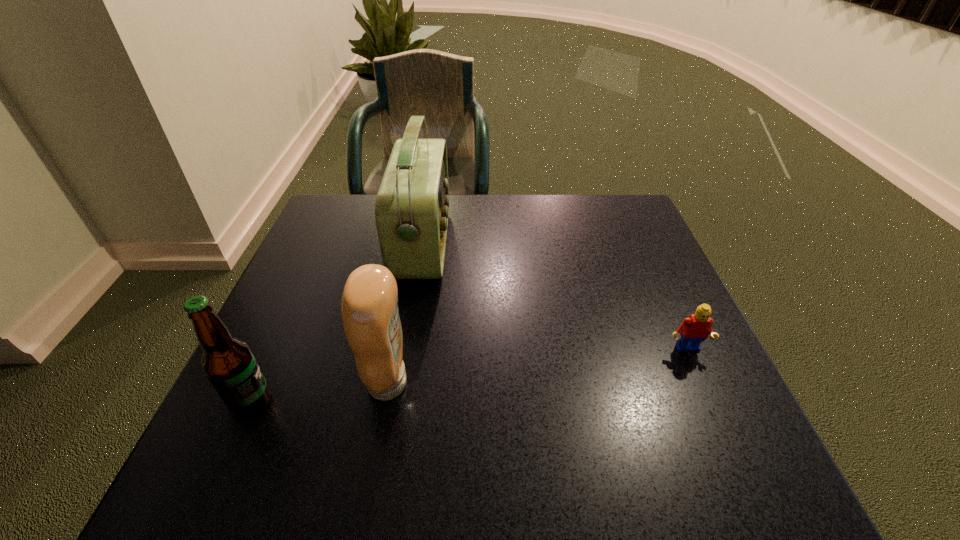
Select which object appears as the third closest to the Lego. Please provide its 2D coordinates. Your answer should be formatted as a tuple, i.e. [(x, y)], where the tuple contains the x and y coordinates of a point satisfying the conditions above.

[(228, 362)]

Locate an element on the screen. The width and height of the screenshot is (960, 540). vacant region that satisfies the following two spatial constraints: 1. on the front-facing side of the shortest object; 2. on the label of the condiment is located at coordinates (701, 383).

The image size is (960, 540). In order to click on vacant space that satisfies the following two spatial constraints: 1. on the front-facing side of the Lego; 2. on the label of the beer bottle in this screenshot , I will do `click(709, 402)`.

Find the location of `free location that satisfies the following two spatial constraints: 1. on the front-facing side of the shortest object; 2. on the label of the beer bottle`. free location that satisfies the following two spatial constraints: 1. on the front-facing side of the shortest object; 2. on the label of the beer bottle is located at coordinates (709, 402).

I want to click on vacant space that satisfies the following two spatial constraints: 1. on the front-facing side of the Lego; 2. on the label of the condiment, so click(x=701, y=383).

Where is `vacant space that satisfies the following two spatial constraints: 1. on the front-facing side of the Lego; 2. on the label of the condiment`? vacant space that satisfies the following two spatial constraints: 1. on the front-facing side of the Lego; 2. on the label of the condiment is located at coordinates pyautogui.click(x=701, y=383).